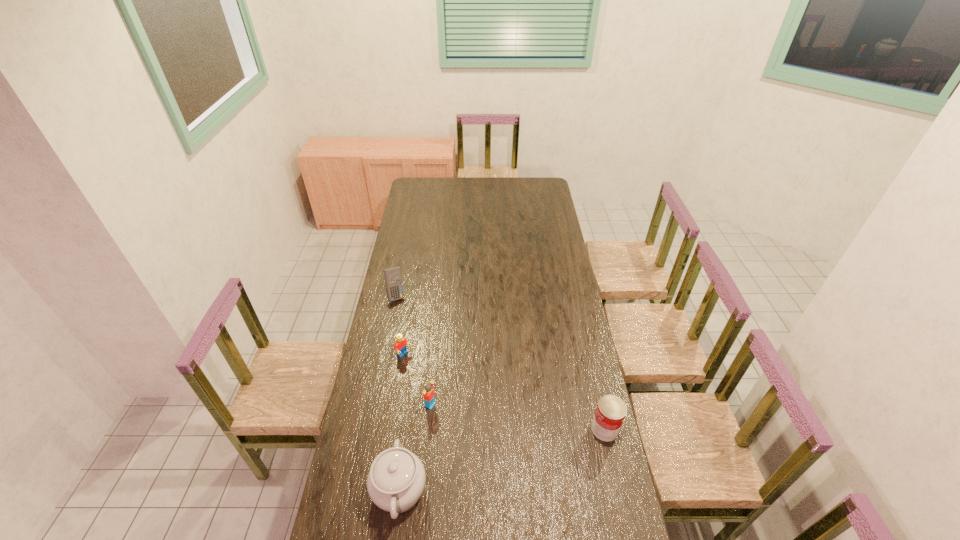
This screenshot has width=960, height=540. In order to click on the nearest object in this screenshot , I will do pos(396,480).

What are the coordinates of `the rightmost object` in the screenshot? It's located at (611, 410).

Find the location of a particular element. can is located at coordinates (611, 410).

This screenshot has height=540, width=960. In order to click on the third nearest object in this screenshot , I will do `click(428, 393)`.

Where is `the nearer Lego`? the nearer Lego is located at coordinates (428, 393).

What are the coordinates of `the fourth nearest object` in the screenshot? It's located at (400, 344).

I want to click on the farther Lego, so click(400, 344).

At what (x,y) coordinates should I click in order to perform the action: click on calculator. Please return your answer as a coordinate pair (x, y). Looking at the image, I should click on (393, 280).

The image size is (960, 540). I want to click on the leftmost object, so click(393, 280).

The width and height of the screenshot is (960, 540). What are the coordinates of `free space located 0.060m on the left of the chinaware` in the screenshot? It's located at (353, 490).